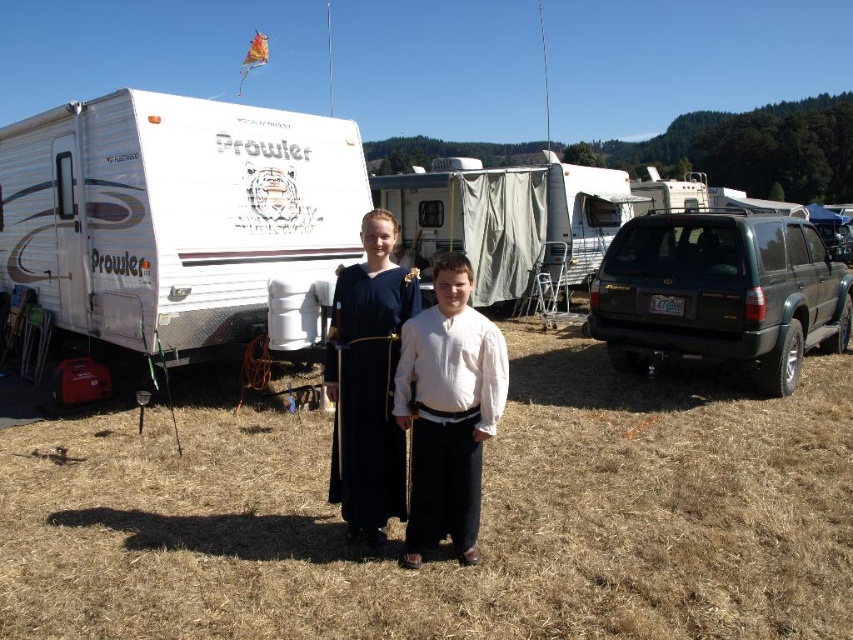
In the scene shown: You are a photographer setting up a shoot at the campsite. You want to position a new model between the dark green plastic suv at right and the dark blue fabric dress at center so that it is equidistant from both. Where should you place the model?

The model should be placed directly between the dark green plastic suv at right and the dark blue fabric dress at center, as the suv is to the right of the dress. This central position ensures equal distance from both objects.

You are a photographer setting up a tripod to take a group photo of the people and the vehicles in the scene. You need to ensure that both the dark green plastic suv at right and the dark blue fabric dress at center are fully visible in the frame. Based on their relative sizes, which object should you position closer to the camera to ensure both are visible without cropping?

The dark green plastic suv at right is taller than the dark blue fabric dress at center. To ensure both are fully visible, position the dark blue fabric dress at center closer to the camera so that its height matches the suv when framed, avoiding cropping.